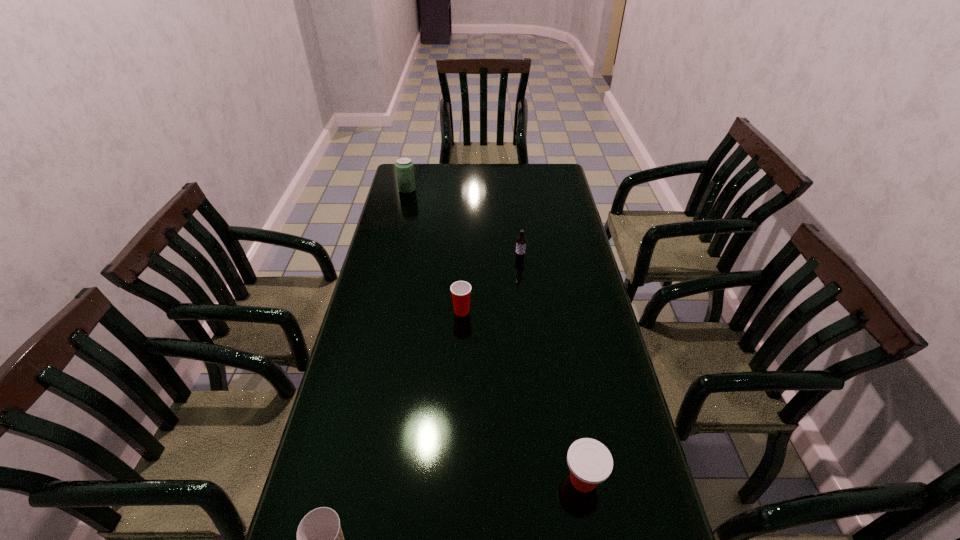
The image size is (960, 540). I want to click on vacant area situated on the back of the fourth farthest object, so [561, 350].

Image resolution: width=960 pixels, height=540 pixels. Find the location of `object that is at the far edge`. object that is at the far edge is located at coordinates (404, 166).

The height and width of the screenshot is (540, 960). Identify the location of object present at the left edge. (404, 166).

Locate an element on the screen. object at the right edge is located at coordinates (590, 462).

Locate an element on the screen. object situated at the far left corner is located at coordinates (404, 166).

Where is `vacant region at the far edge of the desktop`? The height and width of the screenshot is (540, 960). vacant region at the far edge of the desktop is located at coordinates pyautogui.click(x=444, y=167).

The width and height of the screenshot is (960, 540). I want to click on vacant space at the left edge of the desktop, so click(397, 335).

The height and width of the screenshot is (540, 960). I want to click on vacant space at the right edge of the desktop, so click(555, 211).

You are a GUI agent. You are given a task and a screenshot of the screen. Output one action in this format:
    pyautogui.click(x=<x>, y=<y>)
    Task: Click on the free space between the rightmost Dixie cup and the soda
    The height and width of the screenshot is (540, 960).
    Given the screenshot: What is the action you would take?
    pyautogui.click(x=495, y=335)

You are a GUI agent. You are given a task and a screenshot of the screen. Output one action in this format:
    pyautogui.click(x=<x>, y=<y>)
    Task: Click on the free space between the soda and the farthest Dixie cup
    The image size is (960, 540).
    Given the screenshot: What is the action you would take?
    pyautogui.click(x=435, y=251)